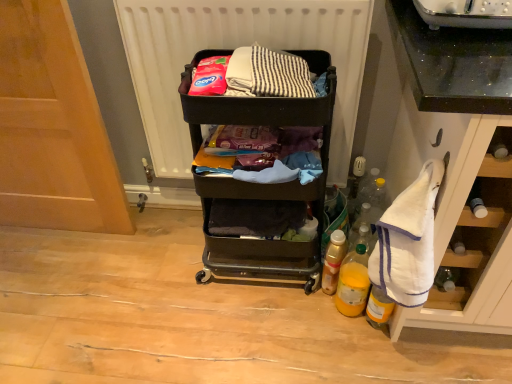
The height and width of the screenshot is (384, 512). In order to click on free space to the left of translucent plastic bottle at lower right, the 1th bottle positioned from the left in this screenshot , I will do `click(283, 294)`.